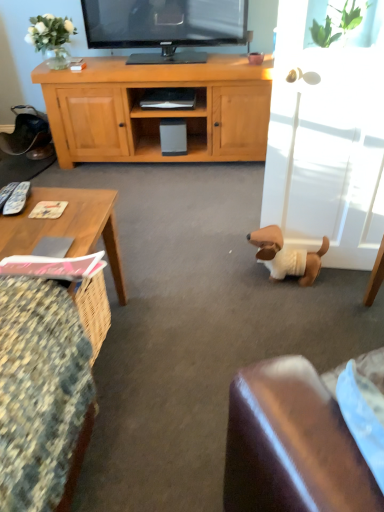
At what (x,y) coordinates should I click in order to perform the action: click on free space to the left of white plush dog at lower right. Please return your answer as a coordinate pair (x, y). Looking at the image, I should click on (235, 278).